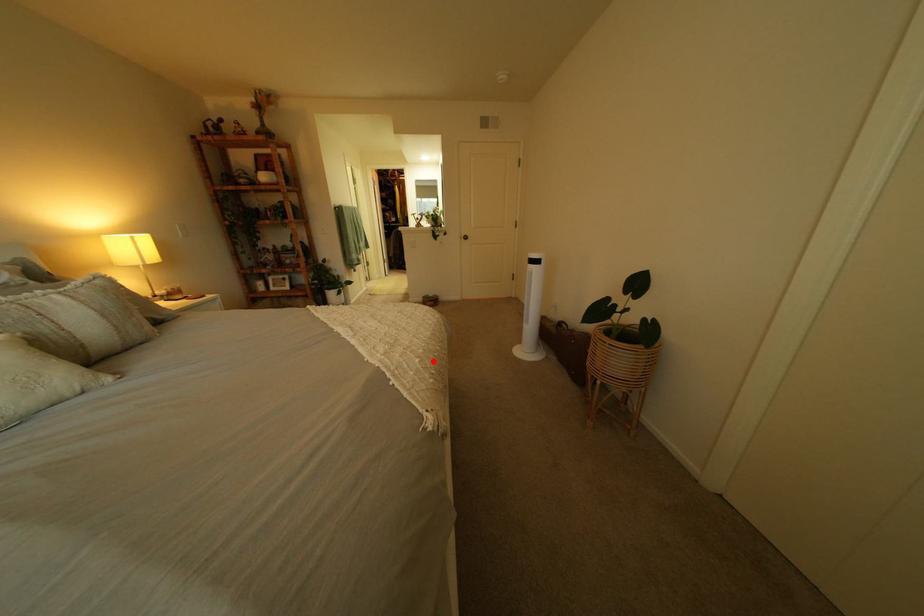
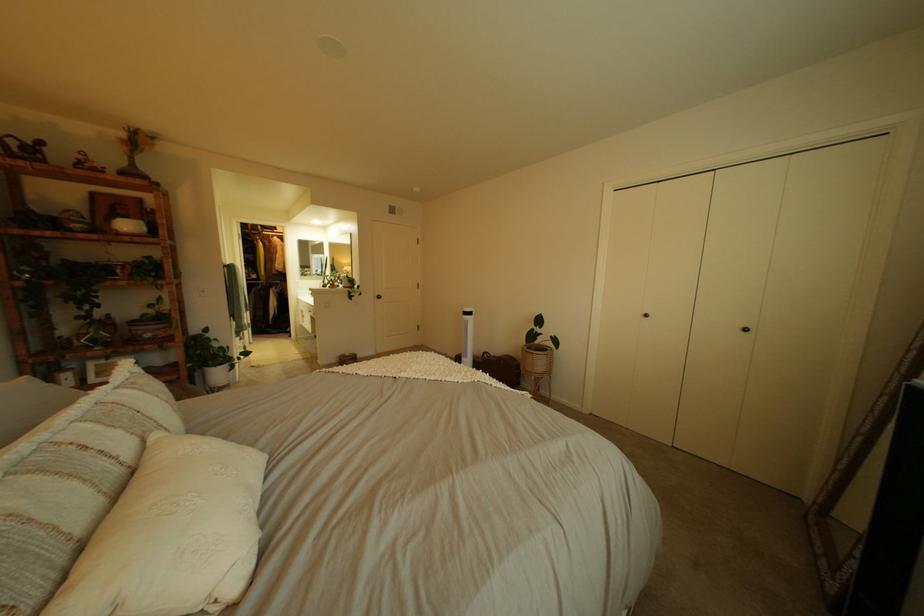
Question: I am providing you with two images of the same scene from different viewpoints. A red point is shown in image1. For the corresponding object point in image2, is it positioned nearer or farther from the camera?

Choices:
 (A) Nearer
 (B) Farther

Answer: (A)